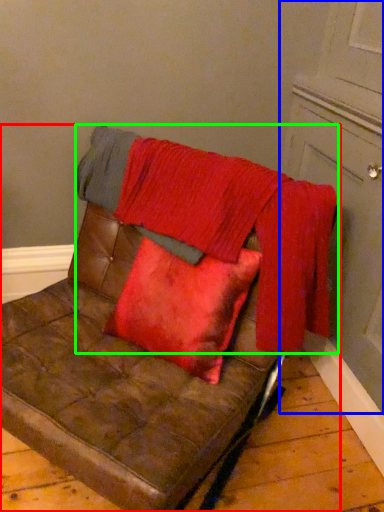
Question: Considering the real-world distances, which object is farthest from furniture (highlighted by a red box)? door (highlighted by a blue box) or blanket (highlighted by a green box)?

Choices:
 (A) door
 (B) blanket

Answer: (A)